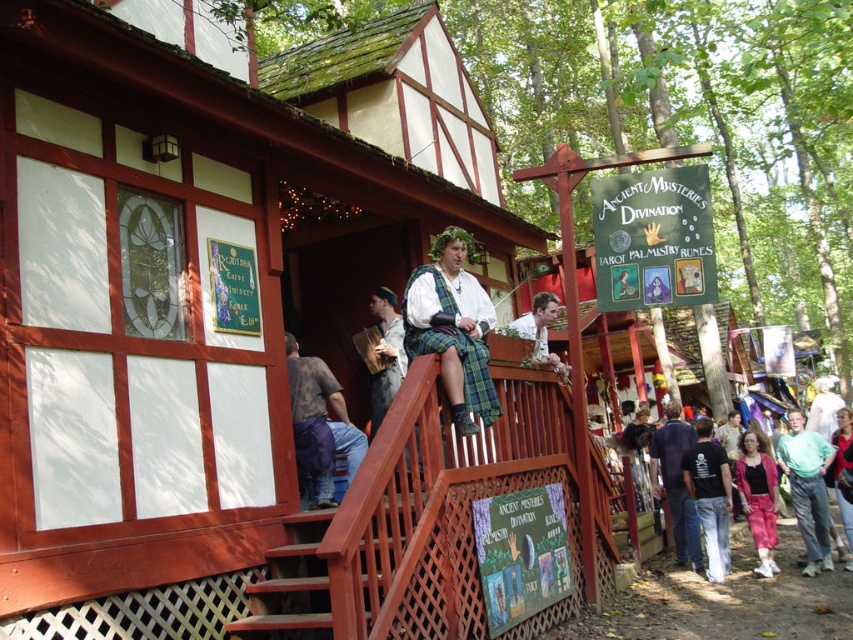
Does brown wooden stairs at lower center have a greater height compared to white cotton shirt at upper center?

No, brown wooden stairs at lower center is not taller than white cotton shirt at upper center.

Does point (299, 596) come behind point (816, 412)?

No, it is in front of (816, 412).

Image resolution: width=853 pixels, height=640 pixels. I want to click on brown wooden stairs at lower center, so click(x=291, y=586).

Is plaid fabric kilt at center positioned in front of green cotton shirt at lower right?

Yes, plaid fabric kilt at center is in front of green cotton shirt at lower right.

Does point (457, 412) come in front of point (822, 515)?

Yes, it is in front of point (822, 515).

Find the location of `plaid fabric kilt at center`. plaid fabric kilt at center is located at coordinates (451, 330).

Is point (404, 436) positioned in front of point (815, 547)?

Yes, point (404, 436) is in front of point (815, 547).

You are a GUI agent. You are given a task and a screenshot of the screen. Output one action in this format:
    pyautogui.click(x=<x>, y=<y>)
    Task: Click on the wooden lattice porch at center
    This screenshot has width=853, height=640.
    Given the screenshot: What is the action you would take?
    pyautogui.click(x=421, y=518)